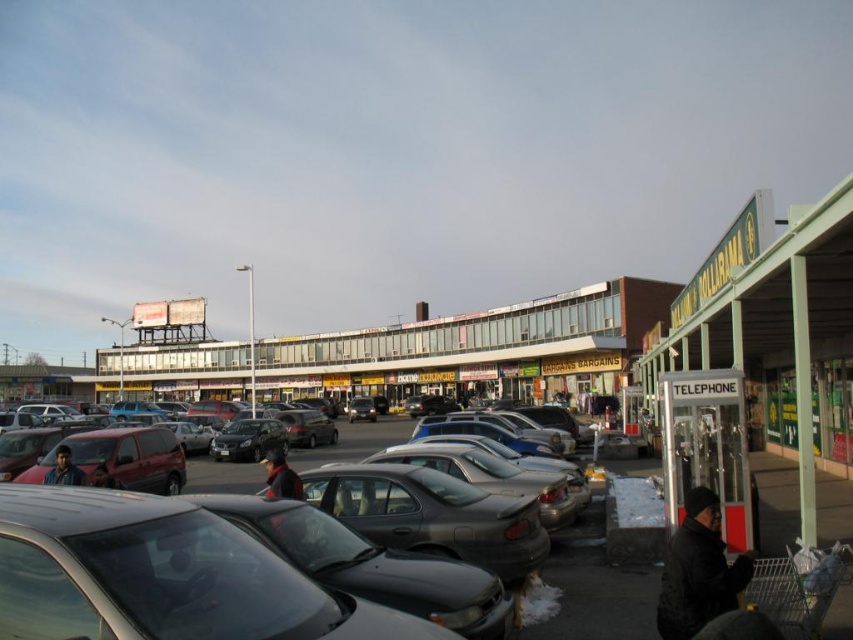
You are standing in the parking lot and want to find the glassy storefronts at center. Based on your position, which direction should you walk to reach them?

The glassy storefronts at center are located at point coordinates, so you should walk towards the center of the parking lot to reach them.